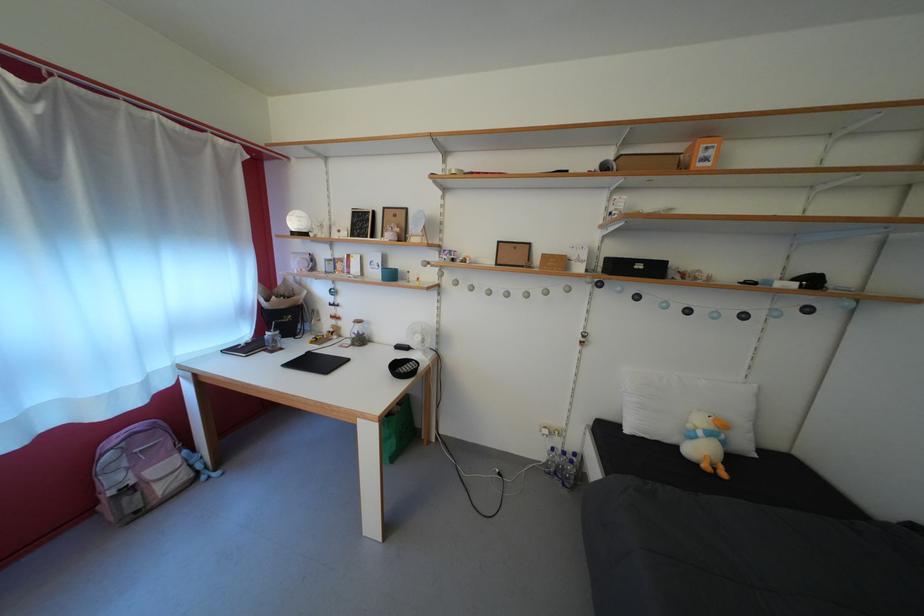
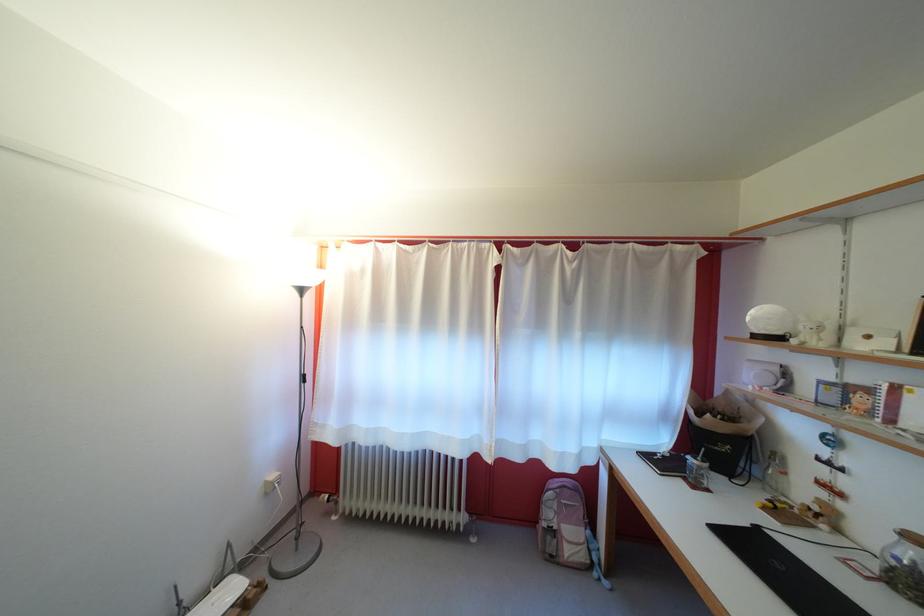
Where in the second image is the point corresponding to [282,342] from the first image?

(708, 474)